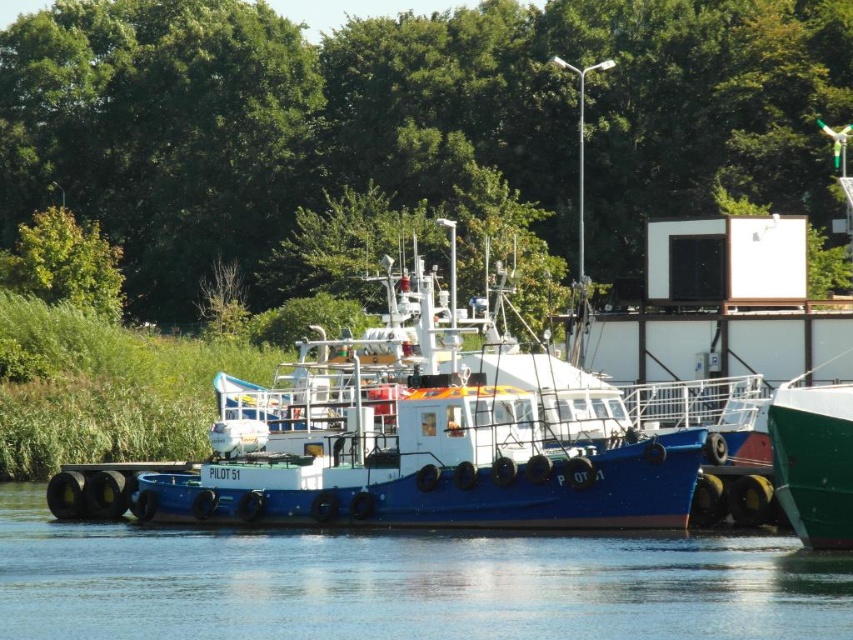
Who is taller, green leafy tree at upper center or blue matte tugboat at center?

Standing taller between the two is green leafy tree at upper center.

Which of these two, green leafy tree at upper center or blue matte tugboat at center, stands shorter?

blue matte tugboat at center is shorter.

Is point (814, 3) less distant than point (314, 404)?

No.

Find the location of `green leafy tree at upper center`. green leafy tree at upper center is located at coordinates (407, 120).

Can you confirm if green leafy tree at upper center is wider than green leafy tree at upper left?

Yes, green leafy tree at upper center is wider than green leafy tree at upper left.

Between green leafy tree at upper center and green leafy tree at upper left, which one has less height?

Standing shorter between the two is green leafy tree at upper left.

Between point (96, 186) and point (96, 305), which one is positioned in front?

Positioned in front is point (96, 305).

I want to click on green leafy tree at upper center, so click(407, 120).

Is blue matte tugboat at center above green leafy tree at upper left?

No, blue matte tugboat at center is not above green leafy tree at upper left.

Where is `blue matte tugboat at center`? blue matte tugboat at center is located at coordinates (393, 444).

Identify the location of blue matte tugboat at center. point(393,444).